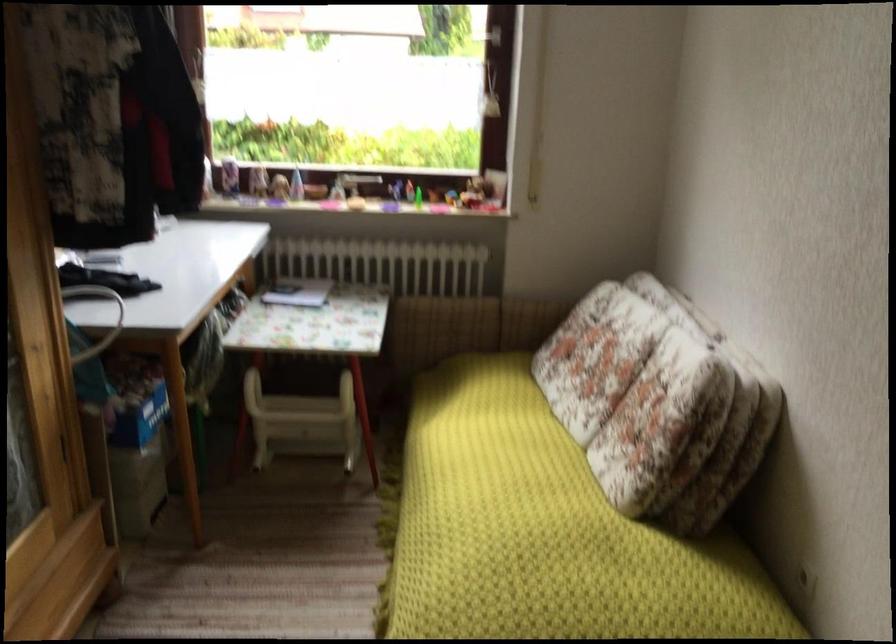
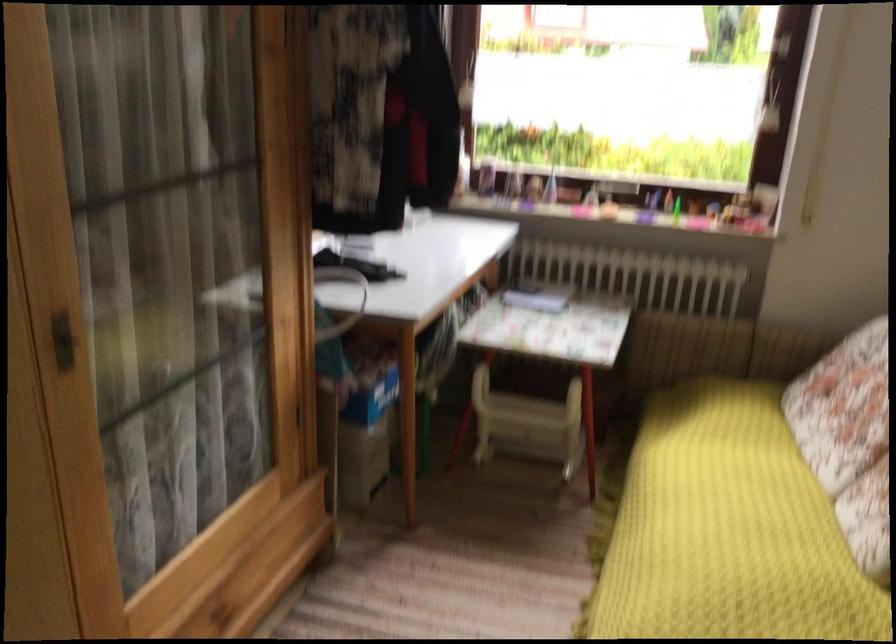
Question: Based on the continuous images, in which direction is the camera rotating? Reply with the corresponding letter.

Choices:
 (A) Left
 (B) Right
 (C) Up
 (D) Down

Answer: (A)